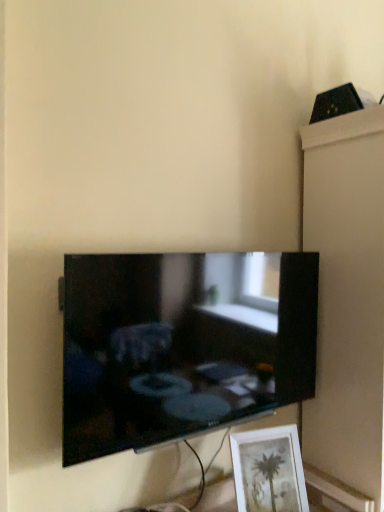
Image resolution: width=384 pixels, height=512 pixels. What are the coordinates of `matte white picture frame at lower right` in the screenshot? It's located at (269, 470).

Locate an element on the screen. Image resolution: width=384 pixels, height=512 pixels. black glossy tv at center is located at coordinates (180, 347).

Describe the element at coordinates (180, 347) in the screenshot. The width and height of the screenshot is (384, 512). I see `black glossy tv at center` at that location.

The height and width of the screenshot is (512, 384). I want to click on matte white picture frame at lower right, so click(x=269, y=470).

Is matte white picture frame at lower right aimed at white glossy cabinet at upper right?

No, matte white picture frame at lower right is not oriented towards white glossy cabinet at upper right.

Does point (293, 501) come farther from viewer compared to point (359, 370)?

No, (293, 501) is closer to viewer.

Looking at their sizes, would you say matte white picture frame at lower right is wider or thinner than white glossy cabinet at upper right?

Clearly, matte white picture frame at lower right has less width compared to white glossy cabinet at upper right.

Can you confirm if matte white picture frame at lower right is smaller than white glossy cabinet at upper right?

Yes.

Is black glossy tv at center far from matte white picture frame at lower right?

No, black glossy tv at center is in close proximity to matte white picture frame at lower right.

From the image's perspective, is black glossy tv at center above matte white picture frame at lower right?

Yes, from the image's perspective, black glossy tv at center is above matte white picture frame at lower right.

Locate an element on the screen. The width and height of the screenshot is (384, 512). television above the matte white picture frame at lower right (from a real-world perspective) is located at coordinates (180, 347).

From a real-world perspective, is black glossy tv at center above or below matte white picture frame at lower right?

black glossy tv at center is above matte white picture frame at lower right.

Considering the points (331, 191) and (264, 496), which point is behind, point (331, 191) or point (264, 496)?

Point (331, 191)

Could you measure the distance between white glossy cabinet at upper right and matte white picture frame at lower right?

The distance of white glossy cabinet at upper right from matte white picture frame at lower right is 17.52 inches.

Considering the sizes of objects white glossy cabinet at upper right and matte white picture frame at lower right in the image provided, who is taller, white glossy cabinet at upper right or matte white picture frame at lower right?

Standing taller between the two is white glossy cabinet at upper right.

In the scene shown: Is white glossy cabinet at upper right facing towards matte white picture frame at lower right?

No, white glossy cabinet at upper right is not aimed at matte white picture frame at lower right.

Is white glossy cabinet at upper right facing towards black glossy tv at center?

No, white glossy cabinet at upper right is not facing towards black glossy tv at center.

Between white glossy cabinet at upper right and black glossy tv at center, which one has less height?

black glossy tv at center is shorter.

Considering the relative sizes of white glossy cabinet at upper right and black glossy tv at center in the image provided, is white glossy cabinet at upper right thinner than black glossy tv at center?

No.

Does matte white picture frame at lower right lie in front of black glossy tv at center?

No, it is not.

Based on the photo, which is more to the left, matte white picture frame at lower right or black glossy tv at center?

Positioned to the left is black glossy tv at center.

From a real-world perspective, which object rests below the other?

From a 3D spatial view, matte white picture frame at lower right is below.

Who is shorter, matte white picture frame at lower right or black glossy tv at center?

With less height is matte white picture frame at lower right.

Considering the sizes of black glossy tv at center and white glossy cabinet at upper right in the image, is black glossy tv at center bigger or smaller than white glossy cabinet at upper right?

Clearly, black glossy tv at center is smaller in size than white glossy cabinet at upper right.

In the image, is black glossy tv at center on the left side or the right side of white glossy cabinet at upper right?

black glossy tv at center is positioned on white glossy cabinet at upper right's left side.

From a real-world perspective, is black glossy tv at center positioned over white glossy cabinet at upper right based on gravity?

Yes.

Identify the location of cabinet above the matte white picture frame at lower right (from the image's perspective). This screenshot has height=512, width=384. (347, 297).

Where is `picture frame lying behind the black glossy tv at center`? picture frame lying behind the black glossy tv at center is located at coordinates (269, 470).

When comparing their distances from white glossy cabinet at upper right, does matte white picture frame at lower right or black glossy tv at center seem further?

matte white picture frame at lower right is further to white glossy cabinet at upper right.

Considering their positions, is black glossy tv at center positioned closer to matte white picture frame at lower right than white glossy cabinet at upper right?

black glossy tv at center lies closer to matte white picture frame at lower right than the other object.

Based on their spatial positions, is white glossy cabinet at upper right or black glossy tv at center closer to matte white picture frame at lower right?

black glossy tv at center is closer to matte white picture frame at lower right.

Considering their positions, is white glossy cabinet at upper right positioned further to black glossy tv at center than matte white picture frame at lower right?

white glossy cabinet at upper right.

Looking at the image, which one is located closer to black glossy tv at center, matte white picture frame at lower right or white glossy cabinet at upper right?

matte white picture frame at lower right is closer to black glossy tv at center.

Which object lies further to the anchor point white glossy cabinet at upper right, black glossy tv at center or matte white picture frame at lower right?

matte white picture frame at lower right is further to white glossy cabinet at upper right.

Identify the location of picture frame located between black glossy tv at center and white glossy cabinet at upper right in the left-right direction. click(269, 470).